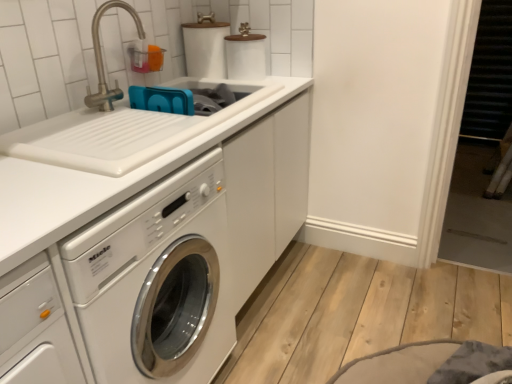
At what (x,y) coordinates should I click in order to perform the action: click on free space in front of white matte toilet paper at upper center. Please return your answer as a coordinate pair (x, y). Looking at the image, I should click on (210, 81).